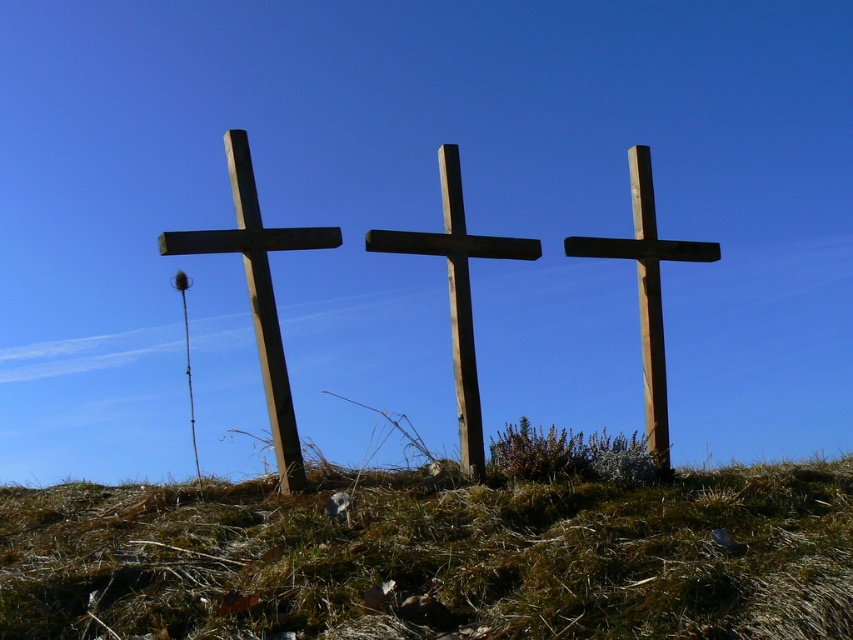
Between wooden cross at left and smooth brown wooden cross at right, which one is positioned lower?

wooden cross at left is below.

Which is more to the left, wooden cross at left or smooth brown wooden cross at right?

wooden cross at left

Measure the distance between point (248, 164) and camera.

The distance of point (248, 164) from camera is 7.26 meters.

Identify the location of wooden cross at left. (259, 292).

Who is positioned more to the left, green grassy at center or wooden cross at left?

From the viewer's perspective, wooden cross at left appears more on the left side.

Does point (730, 582) come closer to viewer compared to point (254, 323)?

That is True.

Is point (143, 524) closer to camera compared to point (323, 244)?

Yes, point (143, 524) is closer to viewer.

You are a GUI agent. You are given a task and a screenshot of the screen. Output one action in this format:
    pyautogui.click(x=<x>, y=<y>)
    Task: Click on the green grassy at center
    Image resolution: width=853 pixels, height=640 pixels.
    Given the screenshot: What is the action you would take?
    click(437, 560)

Is the position of green grassy at center less distant than that of smooth brown wooden cross at right?

That is True.

Can you confirm if green grassy at center is positioned above smooth brown wooden cross at right?

Incorrect, green grassy at center is not positioned above smooth brown wooden cross at right.

Which is behind, point (10, 561) or point (663, 396)?

Point (663, 396)

The width and height of the screenshot is (853, 640). I want to click on green grassy at center, so click(x=437, y=560).